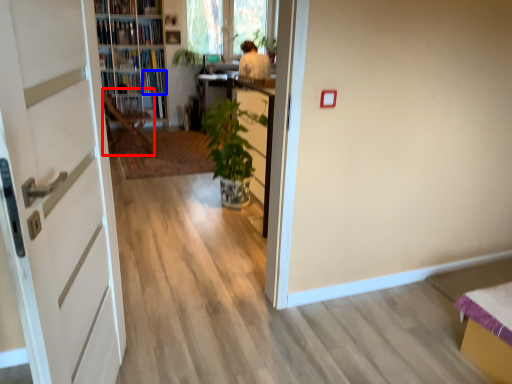
Question: Which point is closer to the camera, chair (highlighted by a red box) or book (highlighted by a blue box)?

Choices:
 (A) chair
 (B) book

Answer: (A)